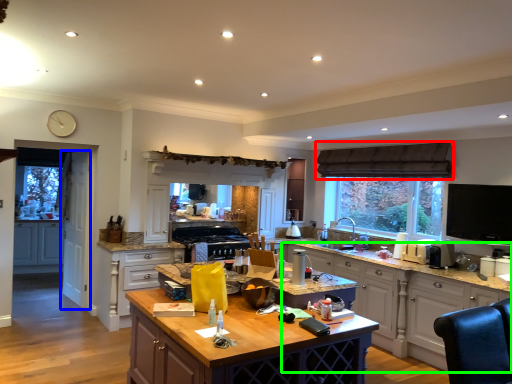
Question: Based on their relative distances, which object is farther from exhaust hood (highlighted by a red box)? Choose from screen door (highlighted by a blue box) and cabinetry (highlighted by a green box).

Choices:
 (A) screen door
 (B) cabinetry

Answer: (A)